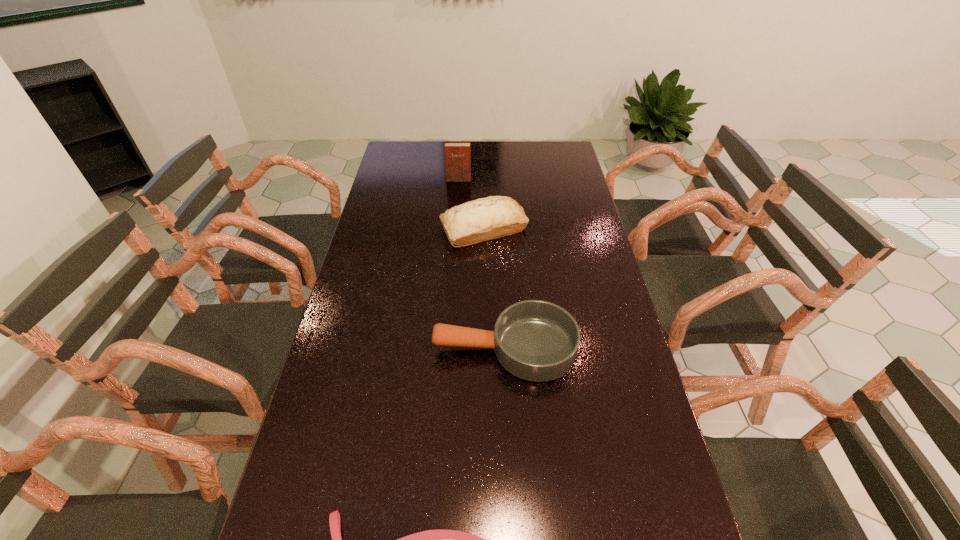
Identify the location of object that is the third closest one to the tallest object. Image resolution: width=960 pixels, height=540 pixels. (440, 539).